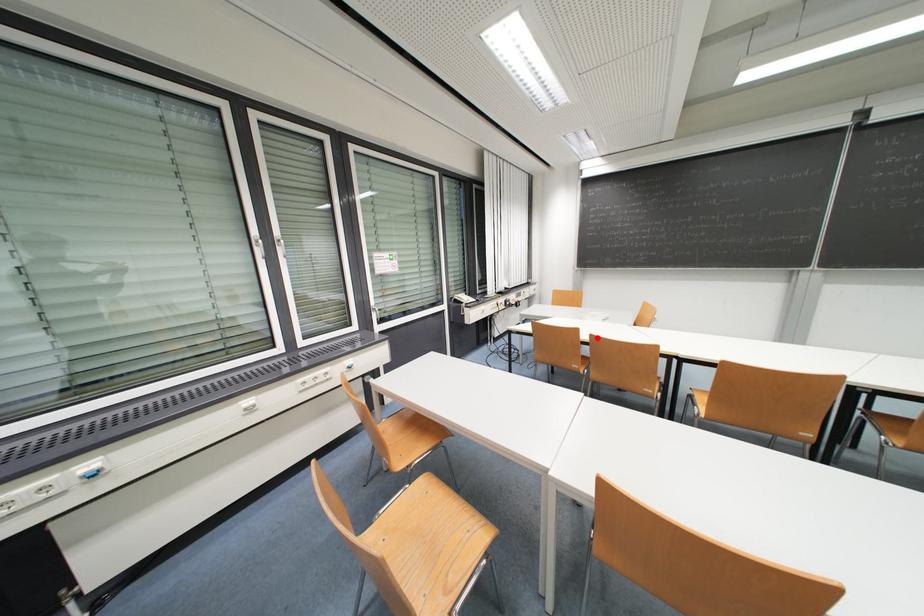
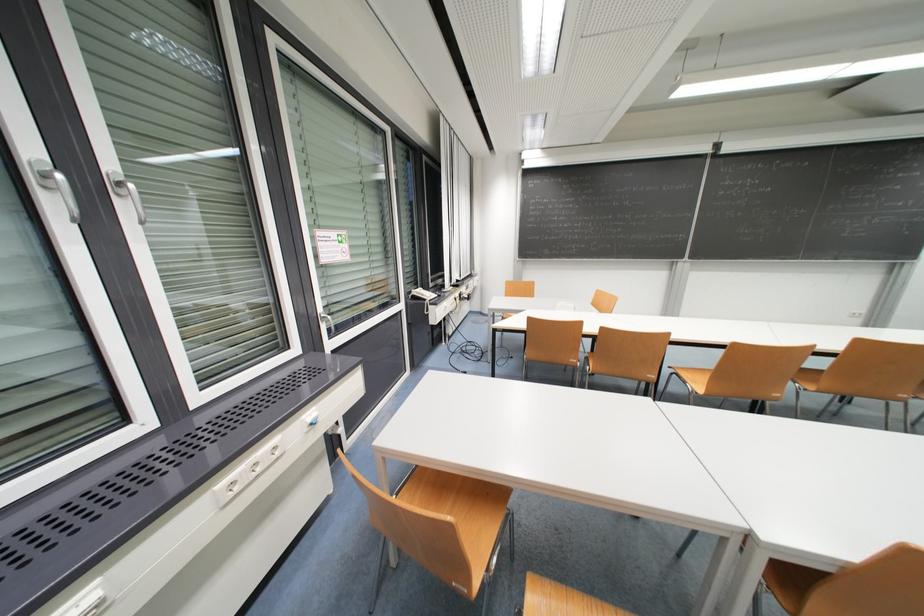
Where in the second image is the point corresponding to the highlighted location from the first image?

(608, 331)